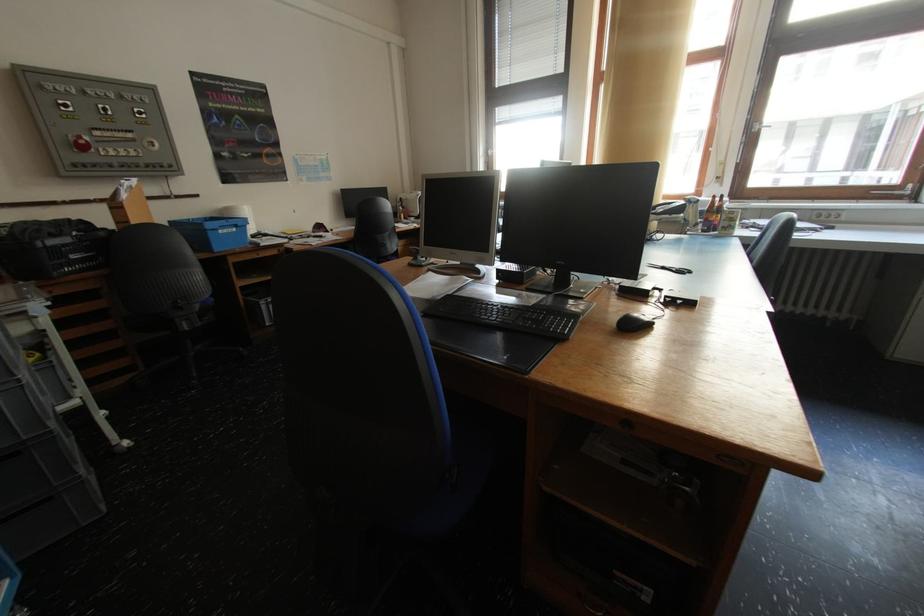
At what (x,y) coordinates should I click in order to perform the action: click on black telephone handset. Please return your answer as a coordinate pair (x, y). Looking at the image, I should click on (669, 208).